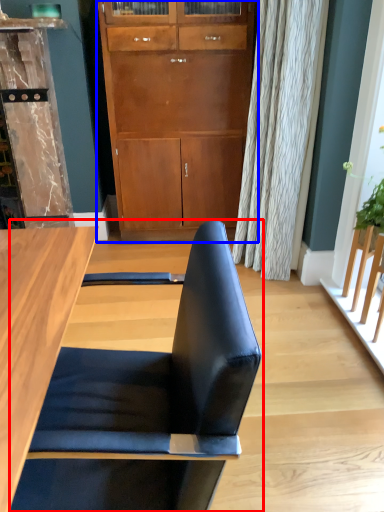
Question: Which object is further to the camera taking this photo, chair (highlighted by a red box) or cabinetry (highlighted by a blue box)?

Choices:
 (A) chair
 (B) cabinetry

Answer: (B)